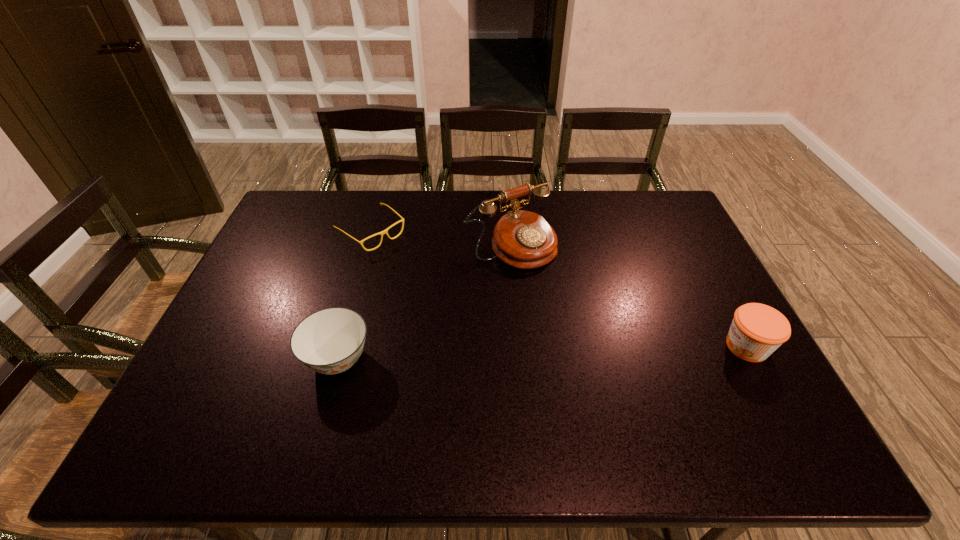
What are the coordinates of `vacant space located in front of the lenses of the shortest object` in the screenshot? It's located at (429, 278).

Find the location of `vacant space situated in front of the lenses of the shortest object`. vacant space situated in front of the lenses of the shortest object is located at coordinates (470, 309).

Find the location of a particular element. The width and height of the screenshot is (960, 540). free space located on the dial of the second object from right to left is located at coordinates (543, 278).

You are a GUI agent. You are given a task and a screenshot of the screen. Output one action in this format:
    pyautogui.click(x=<x>, y=<y>)
    Task: Click on the vacant area situated on the dial of the second object from right to left
    
    Given the screenshot: What is the action you would take?
    pyautogui.click(x=565, y=301)

Locate an element on the screen. The width and height of the screenshot is (960, 540). vacant point located on the dial of the second object from right to left is located at coordinates (583, 320).

Locate an element on the screen. Image resolution: width=960 pixels, height=540 pixels. spectacles that is at the far edge is located at coordinates click(x=382, y=233).

At what (x,y) coordinates should I click in order to perform the action: click on telephone that is at the far edge. Please return your answer as a coordinate pair (x, y). Looking at the image, I should click on (522, 239).

At what (x,y) coordinates should I click in order to perform the action: click on object located at the near edge. Please return your answer as a coordinate pair (x, y). This screenshot has height=540, width=960. Looking at the image, I should click on (330, 341).

What are the coordinates of `object situated at the right edge` in the screenshot? It's located at (757, 330).

In the image, there is a desktop. Where is `vacant space at the far edge`? The height and width of the screenshot is (540, 960). vacant space at the far edge is located at coordinates (x=560, y=197).